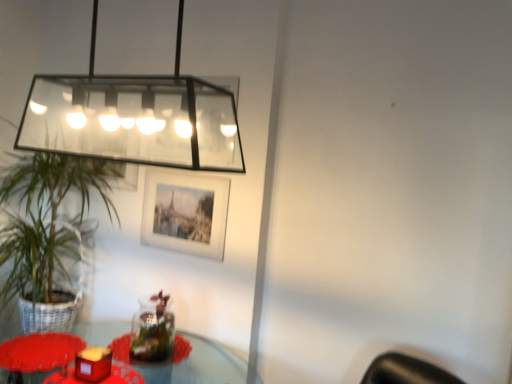
You are a GUI agent. You are given a task and a screenshot of the screen. Output one action in this format:
    pyautogui.click(x=<x>, y=<y>)
    Task: Click on the matte white picture frame at center
    Image resolution: width=512 pixels, height=384 pixels.
    Given the screenshot: What is the action you would take?
    pyautogui.click(x=185, y=213)

You are a GUI agent. You are given a task and a screenshot of the screen. Output one action in this format:
    pyautogui.click(x=<x>, y=<y>)
    Task: Click on the matte red candle at lower left
    The width and height of the screenshot is (512, 384).
    Given the screenshot: What is the action you would take?
    pyautogui.click(x=39, y=352)

Where is `translucent glass table at lower left`? The width and height of the screenshot is (512, 384). translucent glass table at lower left is located at coordinates (198, 365).

What do you see at coordinates (198, 365) in the screenshot? Image resolution: width=512 pixels, height=384 pixels. I see `translucent glass table at lower left` at bounding box center [198, 365].

Describe the element at coordinates (93, 364) in the screenshot. The image size is (512, 384). I see `matte red candle holder at lower left` at that location.

You are a GUI agent. You are given a task and a screenshot of the screen. Output one action in this format:
    pyautogui.click(x=<x>, y=<y>)
    Task: Click on the green leafy plant at left
    
    Given the screenshot: What is the action you would take?
    pyautogui.click(x=46, y=235)

The image size is (512, 384). Find the location of `clear glass rectangular light fixture at upper left`. clear glass rectangular light fixture at upper left is located at coordinates (135, 119).

Between matte red candle at lower left and matte red candle holder at lower left, which one has larger width?

With larger width is matte red candle at lower left.

From a real-world perspective, which is physically below, matte red candle at lower left or matte red candle holder at lower left?

matte red candle at lower left, from a real-world perspective.

Would you say matte red candle at lower left is inside or outside matte red candle holder at lower left?

matte red candle at lower left is located beyond the bounds of matte red candle holder at lower left.

How different are the orientations of matte red candle at lower left and matte red candle holder at lower left in degrees?

The angular difference between matte red candle at lower left and matte red candle holder at lower left is 0.00124 degrees.

Can you confirm if matte red candle at lower left is taller than matte white picture frame at center?

No.

Can you tell me how much matte red candle at lower left and matte white picture frame at center differ in facing direction?

matte red candle at lower left and matte white picture frame at center are facing 94.1 degrees away from each other.

I want to click on picture frame that is on the right side of matte red candle at lower left, so click(x=185, y=213).

In the scene shown: Are clear glass rectangular light fixture at upper left and green leafy plant at left located far from each other?

No, clear glass rectangular light fixture at upper left is not far from green leafy plant at left.

How many degrees apart are the facing directions of clear glass rectangular light fixture at upper left and green leafy plant at left?

The angle between the facing direction of clear glass rectangular light fixture at upper left and the facing direction of green leafy plant at left is 90.4 degrees.

In terms of width, does clear glass rectangular light fixture at upper left look wider or thinner when compared to green leafy plant at left?

Clearly, clear glass rectangular light fixture at upper left has less width compared to green leafy plant at left.

Which is behind, point (38, 83) or point (52, 220)?

The point (52, 220) is behind.

Can you tell me how much clear glass rectangular light fixture at upper left and matte red candle holder at lower left differ in facing direction?

There is a 96-degree angle between the facing directions of clear glass rectangular light fixture at upper left and matte red candle holder at lower left.

Which object is further away from the camera, clear glass rectangular light fixture at upper left or matte red candle holder at lower left?

matte red candle holder at lower left is more distant.

Is clear glass rectangular light fixture at upper left at the right side of matte red candle holder at lower left?

Yes.

Does matte white picture frame at center touch green leafy plant at left?

matte white picture frame at center and green leafy plant at left are not in contact.

Which is nearer, (x=179, y=232) or (x=54, y=272)?

Point (x=179, y=232).

From a real-world perspective, which is physically below, matte white picture frame at center or green leafy plant at left?

green leafy plant at left is physically lower.

Is matte white picture frame at center bigger or smaller than green leafy plant at left?

In the image, matte white picture frame at center appears to be smaller than green leafy plant at left.

Is matte white picture frame at center completely or partially outside of translucent glass table at lower left?

Yes, matte white picture frame at center is located beyond the bounds of translucent glass table at lower left.

From a real-world perspective, is matte white picture frame at center below translucent glass table at lower left?

No.

Could you tell me if matte white picture frame at center is facing translucent glass table at lower left?

No.

Considering the points (162, 376) and (35, 187), which point is in front, point (162, 376) or point (35, 187)?

The point (162, 376) is closer.

Is translucent glass table at lower left situated inside green leafy plant at left or outside?

translucent glass table at lower left is not enclosed by green leafy plant at left.

Based on the photo, from a real-world perspective, is translucent glass table at lower left under green leafy plant at left?

Yes, from a real-world perspective, translucent glass table at lower left is below green leafy plant at left.

Can you confirm if translucent glass table at lower left is wider than green leafy plant at left?

Yes, translucent glass table at lower left is wider than green leafy plant at left.

Find the location of a particular element. candle holder on the right of the matte red candle at lower left is located at coordinates (93, 364).

Find the location of a particular element. This screenshot has width=512, height=384. flower in front of the matte white picture frame at center is located at coordinates (39, 352).

In the scene shown: Looking at the image, which one is located closer to clear glass rectangular light fixture at upper left, green leafy plant at left or matte red candle at lower left?

green leafy plant at left is positioned closer to the anchor clear glass rectangular light fixture at upper left.

Looking at the image, which one is located further to translucent glass table at lower left, matte white picture frame at center or matte red candle holder at lower left?

Among the two, matte white picture frame at center is located further to translucent glass table at lower left.

Based on their spatial positions, is matte red candle at lower left or matte red candle holder at lower left closer to green leafy plant at left?

Based on the image, matte red candle at lower left appears to be nearer to green leafy plant at left.

From the image, which object appears to be nearer to matte red candle at lower left, clear glass rectangular light fixture at upper left or matte white picture frame at center?

matte white picture frame at center lies closer to matte red candle at lower left than the other object.

When comparing their distances from translucent glass table at lower left, does matte white picture frame at center or clear glass rectangular light fixture at upper left seem further?

clear glass rectangular light fixture at upper left.

Considering their positions, is translucent glass table at lower left positioned closer to clear glass rectangular light fixture at upper left than matte red candle holder at lower left?

Among the two, matte red candle holder at lower left is located nearer to clear glass rectangular light fixture at upper left.

Looking at this image, looking at the image, which one is located further to matte red candle holder at lower left, green leafy plant at left or translucent glass table at lower left?

The object further to matte red candle holder at lower left is green leafy plant at left.

When comparing their distances from matte white picture frame at center, does clear glass rectangular light fixture at upper left or matte red candle at lower left seem closer?

clear glass rectangular light fixture at upper left lies closer to matte white picture frame at center than the other object.

Where is `houseplant between clear glass rectangular light fixture at upper left and matte red candle at lower left vertically`? The image size is (512, 384). houseplant between clear glass rectangular light fixture at upper left and matte red candle at lower left vertically is located at coordinates tap(46, 235).

Locate an element on the screen. Image resolution: width=512 pixels, height=384 pixels. candle holder positioned between translucent glass table at lower left and matte red candle at lower left from near to far is located at coordinates (93, 364).

At what (x,y) coordinates should I click in order to perform the action: click on flower between matte white picture frame at center and translucent glass table at lower left in the vertical direction. Please return your answer as a coordinate pair (x, y). The image size is (512, 384). Looking at the image, I should click on (39, 352).

This screenshot has width=512, height=384. What are the coordinates of `picture frame between clear glass rectangular light fixture at upper left and matte red candle holder at lower left in the vertical direction` in the screenshot? It's located at (185, 213).